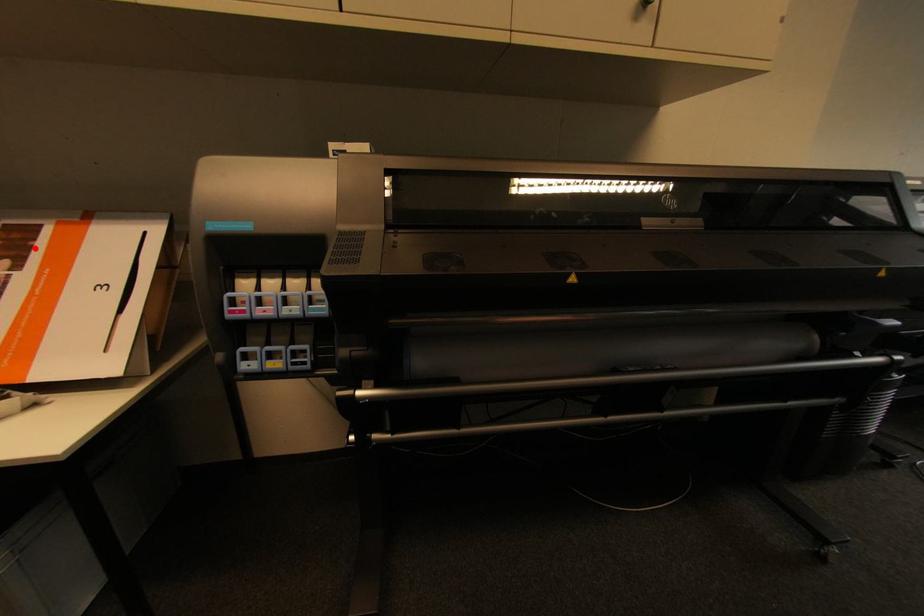
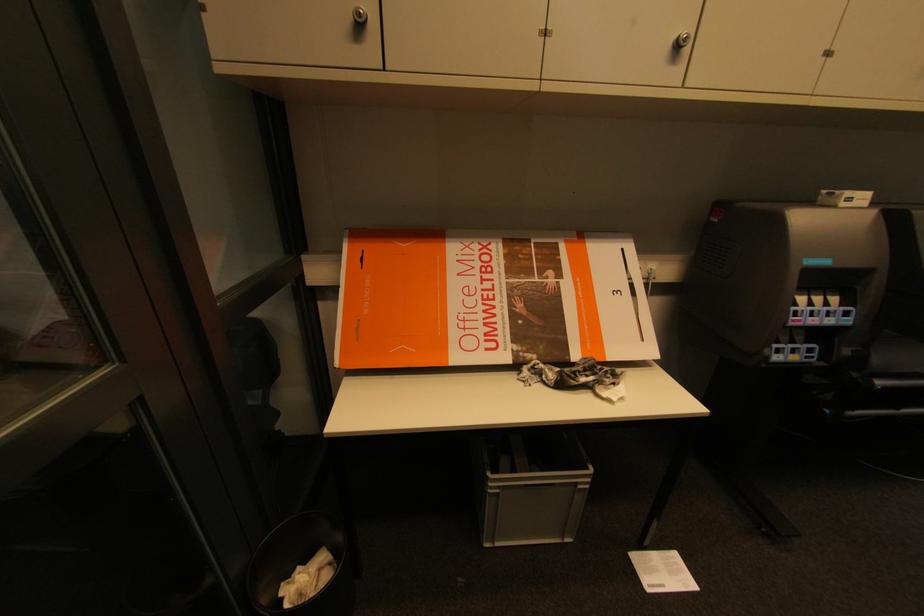
Find the pixel in the second image that matches the highlighted location in the first image.

(564, 262)